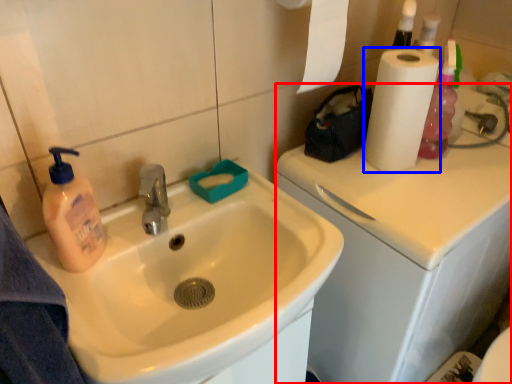
Question: Among these objects, which one is farthest to the camera, counter top (highlighted by a red box) or paper towel (highlighted by a blue box)?

Choices:
 (A) counter top
 (B) paper towel

Answer: (B)